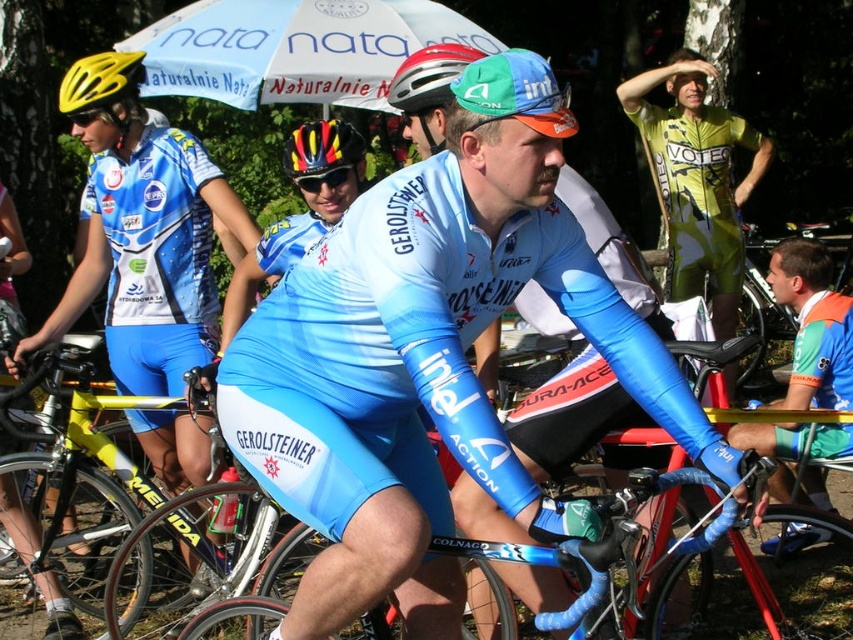
Question: Is matte blue helmet at center positioned in front of yellow matte helmet at upper left?

Choices:
 (A) no
 (B) yes

Answer: (B)

Question: Where is matte blue helmet at center located in relation to yellow/black/red matte bicycle helmet at center in the image?

Choices:
 (A) right
 (B) left

Answer: (A)

Question: Considering the relative positions of blue jersey at center and matte blue helmet at center in the image provided, where is blue jersey at center located with respect to matte blue helmet at center?

Choices:
 (A) above
 (B) below

Answer: (B)

Question: Which object is positioned closest to the matte blue jersey at center?

Choices:
 (A) matte blue helmet at center
 (B) yellow-green jersey at upper right
 (C) yellow/black/red matte bicycle helmet at center

Answer: (C)

Question: Which object is closer to the camera taking this photo?

Choices:
 (A) yellow/black/red matte bicycle helmet at center
 (B) yellow-green jersey at upper right
 (C) orange fabric jersey at center

Answer: (A)

Question: Based on their relative distances, which object is nearer to the matte blue helmet at center?

Choices:
 (A) orange fabric jersey at center
 (B) blue jersey at center
 (C) matte blue jersey at center
 (D) yellow matte helmet at upper left

Answer: (B)